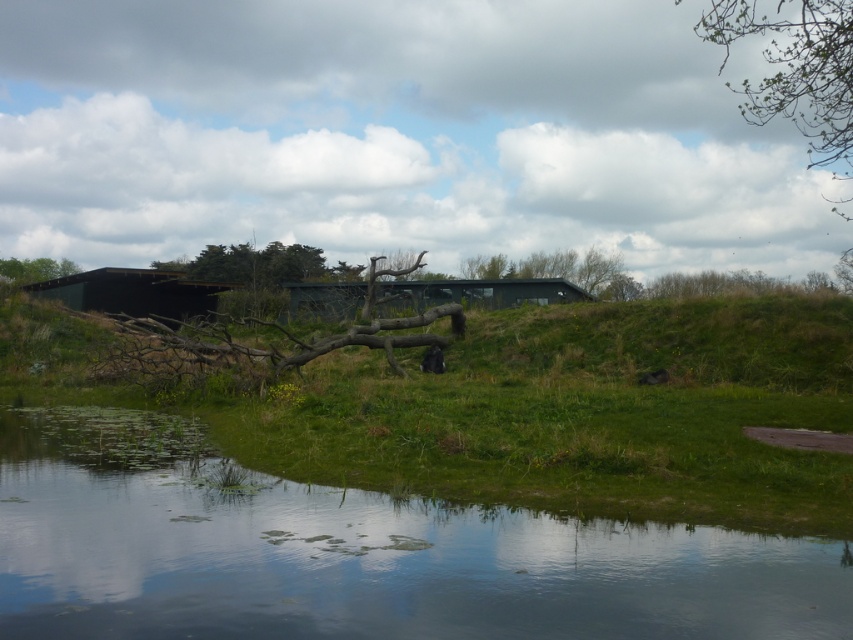
You are standing at the origin point of the coordinate system. You want to reach the matte black hut at center. Which direction should you move in?

You should move towards the point at coordinate 0.459 on the x axis and 0.556 on the y axis to reach the matte black hut at center.

You are an architect designing a new garden and want to place a small statue between the green leafy branch at upper right and the green matte hut at center. Which object should the statue be closer to if you want it to appear proportionally balanced?

The statue should be closer to the green leafy branch at upper right because its width is larger than the green matte hut at center, creating a balanced visual weight.